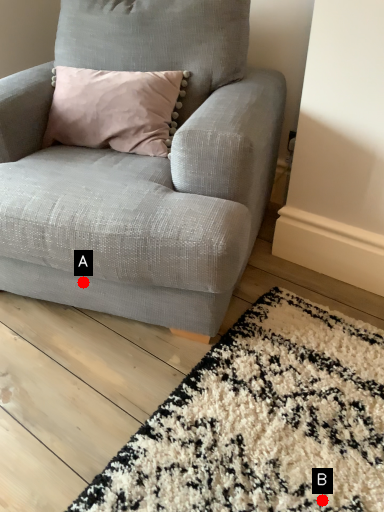
Question: Two points are circled on the image, labeled by A and B beside each circle. Which point is farther from the camera taking this photo?

Choices:
 (A) A is further
 (B) B is further

Answer: (A)